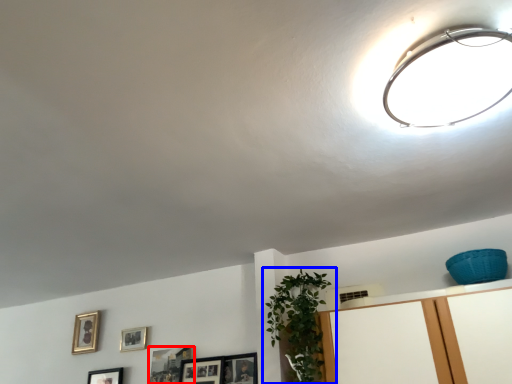
Question: Among these objects, which one is nearest to the camera, picture frame (highlighted by a red box) or houseplant (highlighted by a blue box)?

Choices:
 (A) picture frame
 (B) houseplant

Answer: (B)